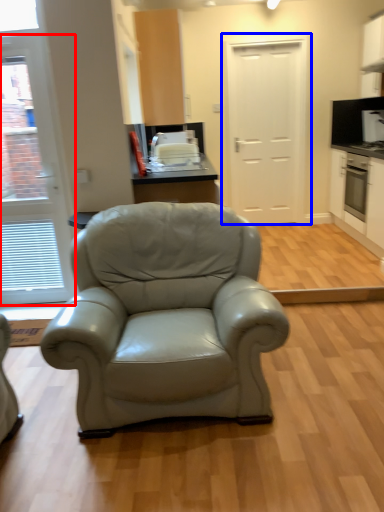
Question: Which object is closer to the camera taking this photo, door (highlighted by a red box) or door (highlighted by a blue box)?

Choices:
 (A) door
 (B) door

Answer: (A)